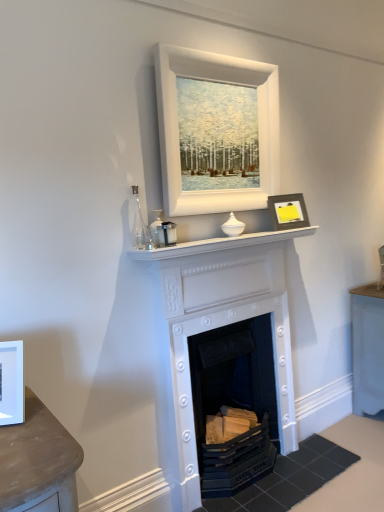
At what (x,y) coordinates should I click in order to perform the action: click on empty space that is ontop of white matte picture frame at upper center, placed as the second picture frame when sorted from front to back (from a real-world perspective). Please return your answer as a coordinate pair (x, y). Looking at the image, I should click on (218, 53).